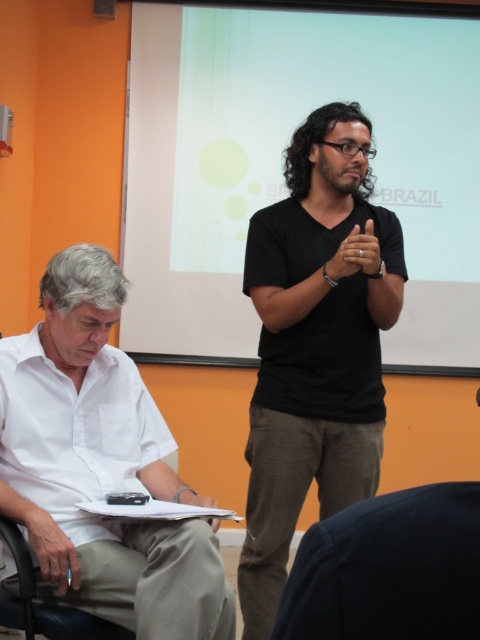
You are organizing a clothing donation drive and need to categorize shirts based on their thickness. You have a black matte shirt at center and a white cotton shirt at left. Which shirt should you place in the thicker category?

The white cotton shirt at left is thicker than the black matte shirt at center, so you should place the white cotton shirt at left in the thicker category.